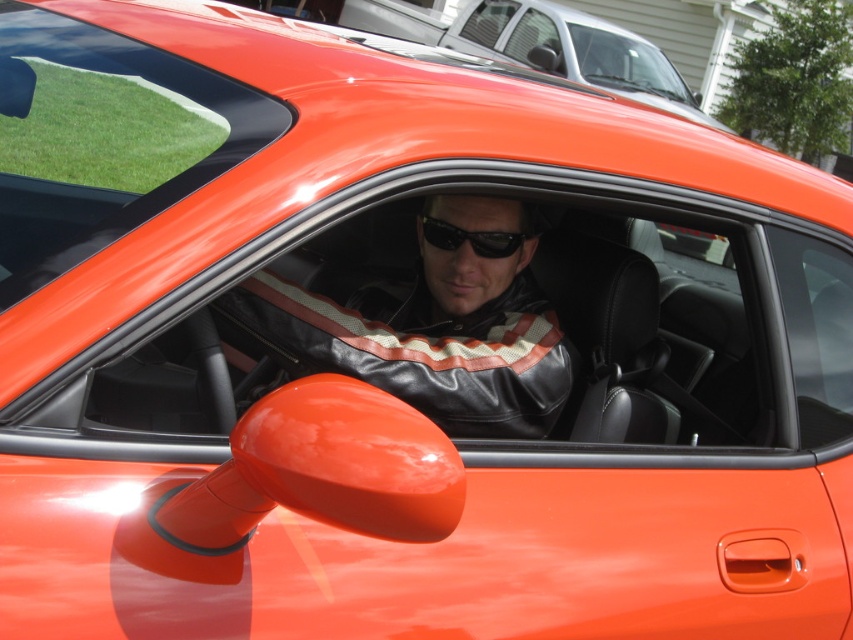
Can you confirm if leather jacket at center is taller than black matte sunglasses at center?

Indeed, leather jacket at center has a greater height compared to black matte sunglasses at center.

Is leather jacket at center smaller than black matte sunglasses at center?

No, leather jacket at center is not smaller than black matte sunglasses at center.

Find the location of a particular element. This screenshot has height=640, width=853. leather jacket at center is located at coordinates (433, 324).